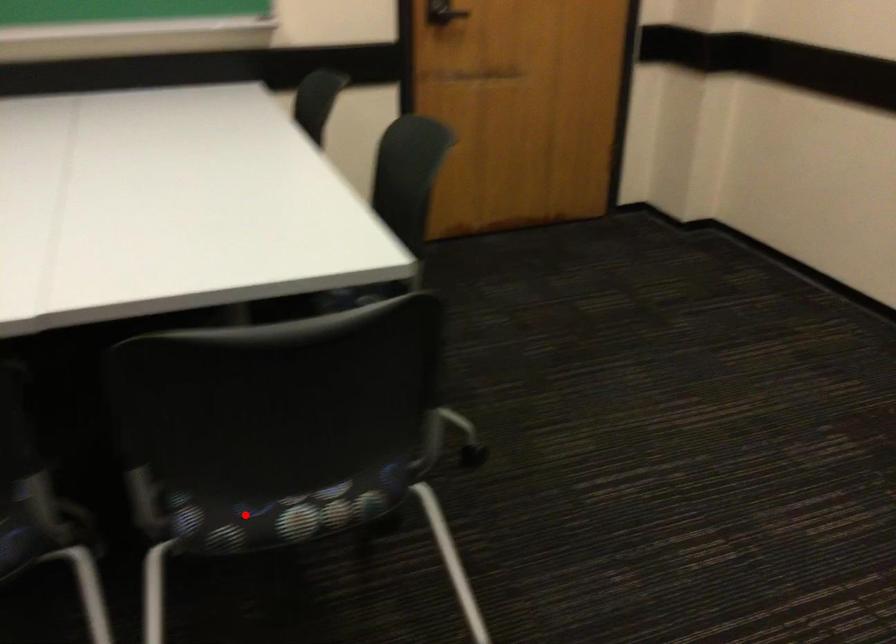
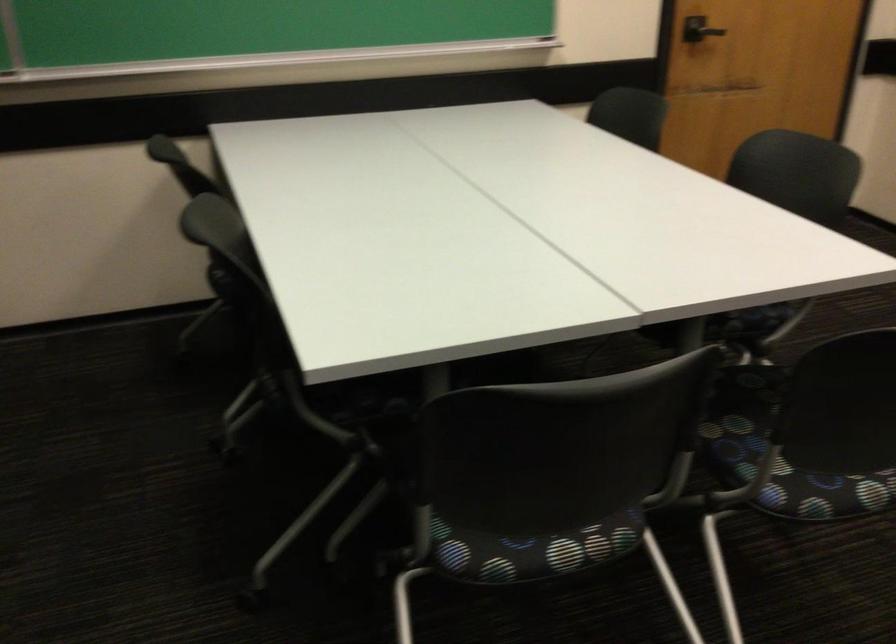
In the second image, find the point that corresponds to the highlighted location in the first image.

(823, 493)